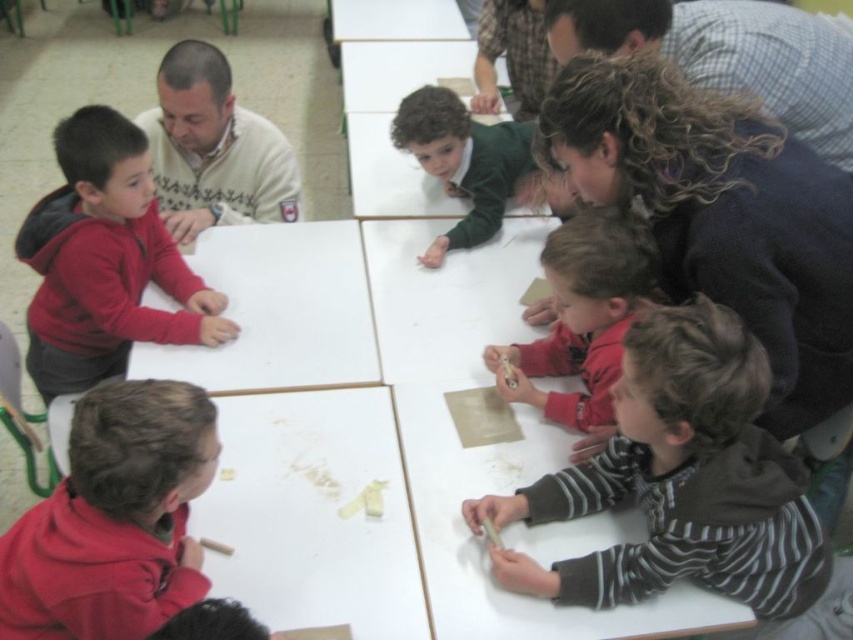
You are a teacher in the classroom and want to place a new poster on the wall next to the white sweater at upper left and the white matte table at center. Which object should you place the poster closer to if you want it to be near the left side of the wall?

You should place the poster closer to the white sweater at upper left because it is positioned to the left of the white matte table at center, making it closer to the left side of the wall.

You are standing at the entrance of the classroom and see two points marked in the scene. The first point is at coordinate point (169, 163) and the second is at point (358, 44). Which point is closer to you?

Point (169, 163) is in front of point (358, 44), so it is closer to you.